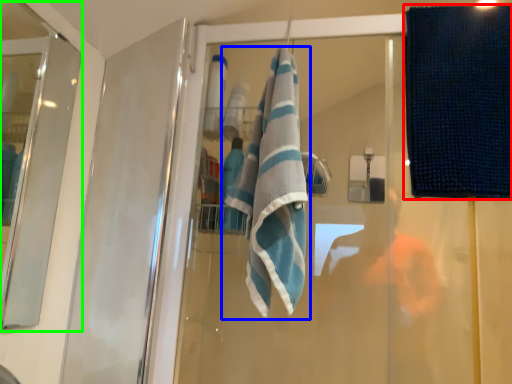
Question: Considering the real-world distances, which object is farthest from beach towel (highlighted by a red box)? towel (highlighted by a blue box) or screen door (highlighted by a green box)?

Choices:
 (A) towel
 (B) screen door

Answer: (B)